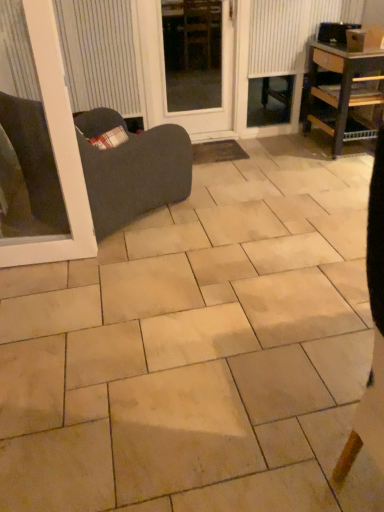
Question: Considering the relative sizes of matte white blind at upper left and white textured radiator at upper right in the image provided, is matte white blind at upper left wider than white textured radiator at upper right?

Choices:
 (A) yes
 (B) no

Answer: (B)

Question: Does matte white blind at upper left lie behind white textured radiator at upper right?

Choices:
 (A) yes
 (B) no

Answer: (B)

Question: Considering the relative sizes of matte white blind at upper left and white textured radiator at upper right in the image provided, is matte white blind at upper left bigger than white textured radiator at upper right?

Choices:
 (A) no
 (B) yes

Answer: (A)

Question: Is matte white blind at upper left placed right next to white textured radiator at upper right?

Choices:
 (A) yes
 (B) no

Answer: (B)

Question: From the image's perspective, is matte white blind at upper left on top of white textured radiator at upper right?

Choices:
 (A) no
 (B) yes

Answer: (A)

Question: Can you confirm if matte white blind at upper left is smaller than white textured radiator at upper right?

Choices:
 (A) no
 (B) yes

Answer: (B)

Question: Considering the relative sizes of beige ceramic tile at center and matte white blind at upper left in the image provided, is beige ceramic tile at center smaller than matte white blind at upper left?

Choices:
 (A) no
 (B) yes

Answer: (A)

Question: Is beige ceramic tile at center facing towards matte white blind at upper left?

Choices:
 (A) yes
 (B) no

Answer: (B)

Question: Does beige ceramic tile at center come behind matte white blind at upper left?

Choices:
 (A) no
 (B) yes

Answer: (A)

Question: From the image's perspective, is beige ceramic tile at center below matte white blind at upper left?

Choices:
 (A) yes
 (B) no

Answer: (A)

Question: Does beige ceramic tile at center have a greater width compared to matte white blind at upper left?

Choices:
 (A) no
 (B) yes

Answer: (B)

Question: Would you say beige ceramic tile at center contains matte white blind at upper left?

Choices:
 (A) yes
 (B) no

Answer: (B)

Question: Is brown woven mat at center wider than wooden shelf at right?

Choices:
 (A) yes
 (B) no

Answer: (B)